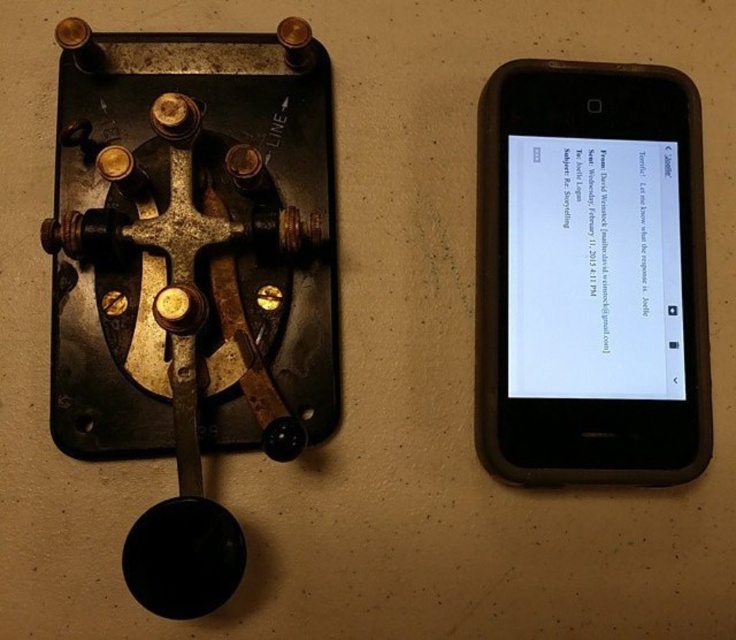
Who is shorter, rusty metal/brass hook at center-left or black plastic smartphone at right?

Standing shorter between the two is black plastic smartphone at right.

Between rusty metal/brass hook at center-left and black plastic smartphone at right, which one is positioned higher?

black plastic smartphone at right

Does point (319, 348) come closer to viewer compared to point (645, 170)?

Yes, it is in front of point (645, 170).

Where is `rusty metal/brass hook at center-left`? The width and height of the screenshot is (736, 640). rusty metal/brass hook at center-left is located at coordinates (191, 275).